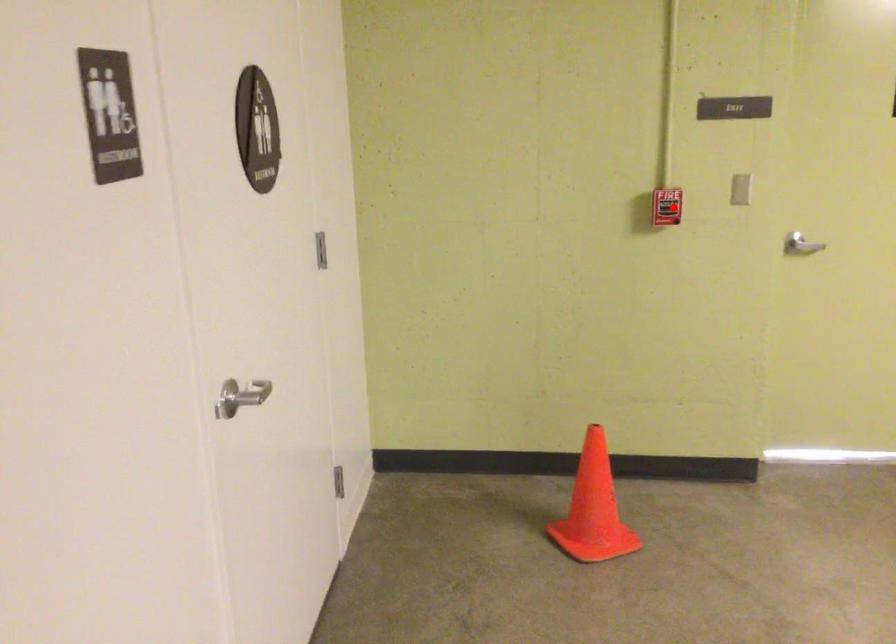
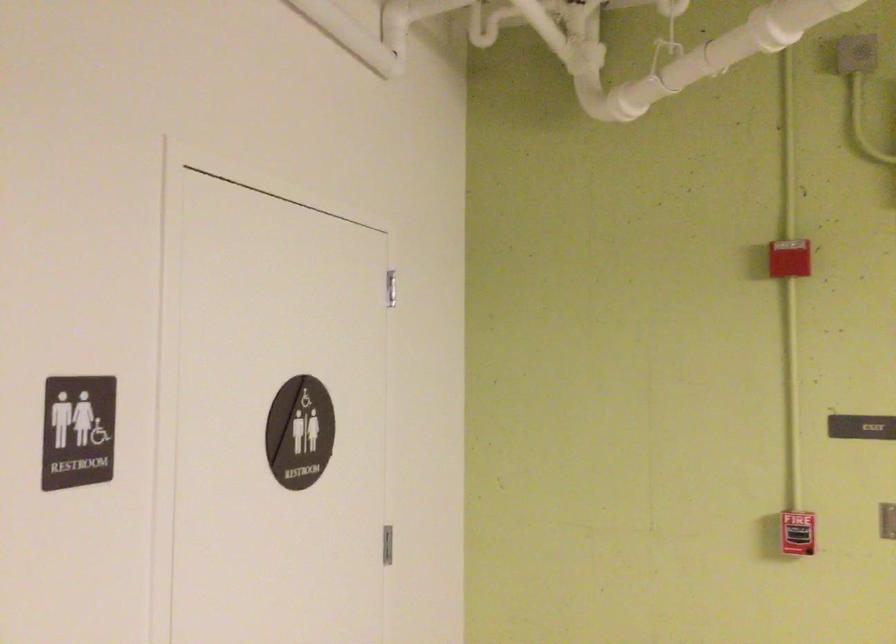
Locate, in the second image, the point that corresponds to the highlighted location in the first image.

(797, 533)